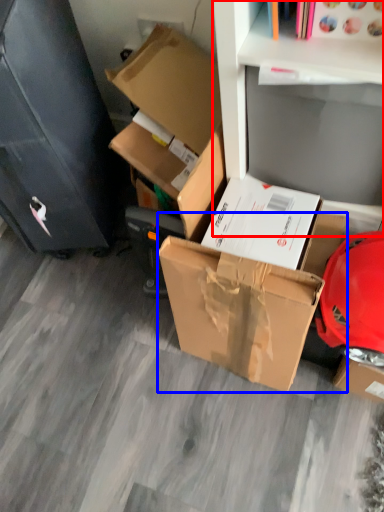
Question: Among these objects, which one is farthest to the camera, shelf (highlighted by a red box) or box (highlighted by a blue box)?

Choices:
 (A) shelf
 (B) box

Answer: (B)